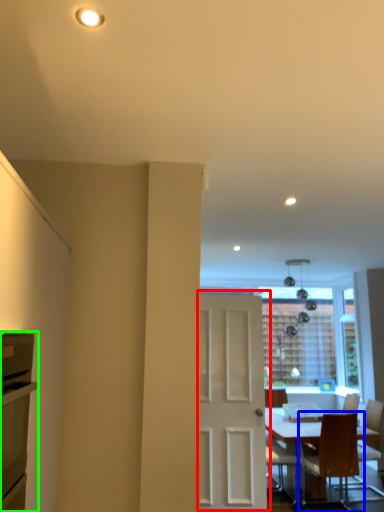
Question: Based on their relative distances, which object is farther from door (highlighted by a red box)? Choose from chair (highlighted by a blue box) and cabinetry (highlighted by a green box).

Choices:
 (A) chair
 (B) cabinetry

Answer: (B)